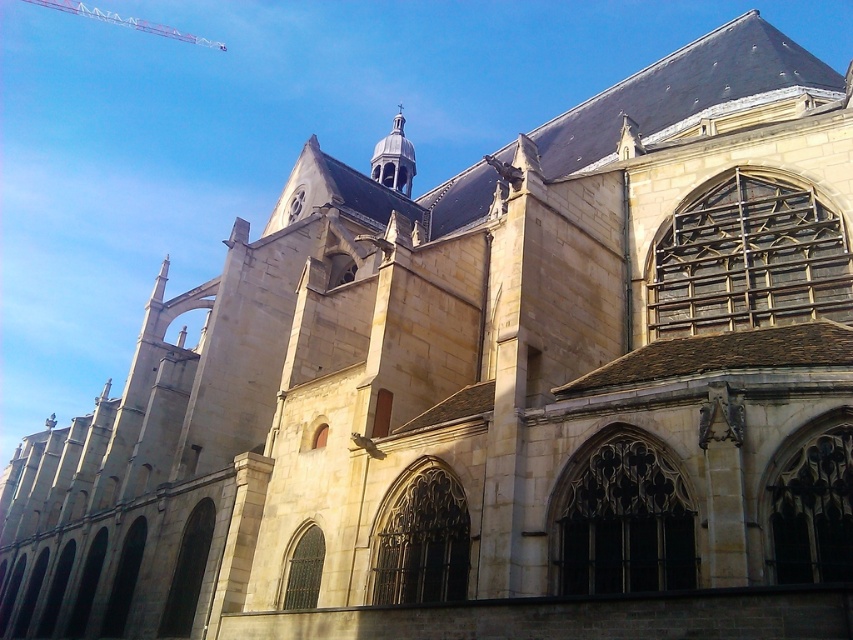
Question: Which point appears closest to the camera in this image?

Choices:
 (A) (378, 173)
 (B) (53, 3)

Answer: (A)

Question: Can you confirm if smooth gray spire at upper center is positioned below metallic red crane at upper left?

Choices:
 (A) no
 (B) yes

Answer: (B)

Question: Does smooth gray spire at upper center have a lesser width compared to metallic red crane at upper left?

Choices:
 (A) no
 (B) yes

Answer: (B)

Question: Which point appears farthest from the camera in this image?

Choices:
 (A) (113, 19)
 (B) (402, 131)

Answer: (A)

Question: Does smooth gray spire at upper center appear under metallic red crane at upper left?

Choices:
 (A) no
 (B) yes

Answer: (B)

Question: Which object is farther from the camera taking this photo?

Choices:
 (A) smooth gray spire at upper center
 (B) metallic red crane at upper left

Answer: (B)